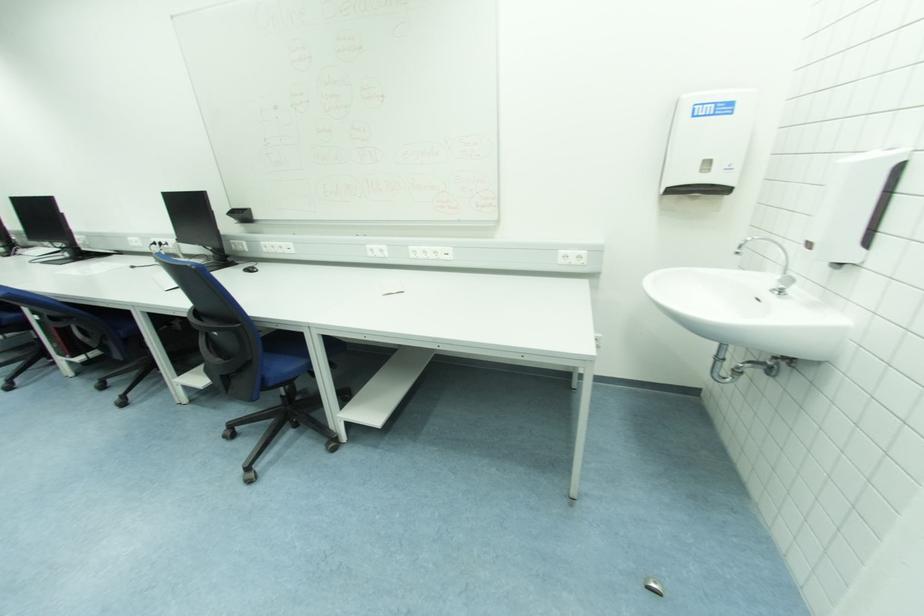
Where would you pull the paper towel dispenser? Please return your answer as a coordinate pair (x, y).

(708, 142)